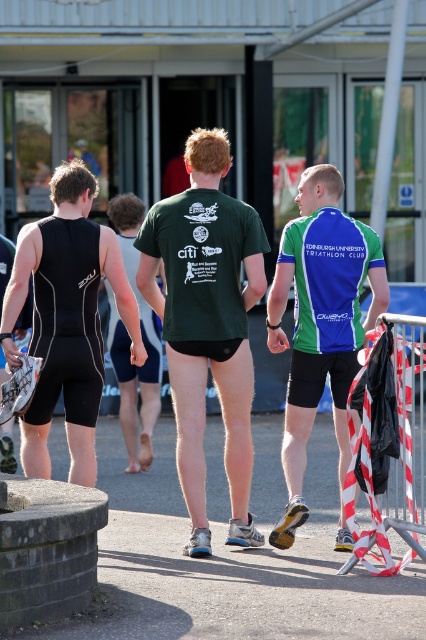
Between green matte t-shirt at center and black matte wetsuit at left, which one has less height?

black matte wetsuit at left

Is green matte t-shirt at center thinner than black matte wetsuit at left?

In fact, green matte t-shirt at center might be wider than black matte wetsuit at left.

What do you see at coordinates (207, 323) in the screenshot?
I see `green matte t-shirt at center` at bounding box center [207, 323].

This screenshot has height=640, width=426. In order to click on green matte t-shirt at center in this screenshot , I will do `click(207, 323)`.

From the picture: Is black matte wetsuit at left closer to the viewer compared to green matte shorts at center?

That is True.

Is black matte wetsuit at left wider than green matte shorts at center?

Incorrect, black matte wetsuit at left's width does not surpass green matte shorts at center's.

Which is in front, point (42, 410) or point (129, 433)?

Point (42, 410) is in front.

Where is `black matte wetsuit at left`? black matte wetsuit at left is located at coordinates (66, 321).

Can you confirm if green/blue jersey at center is bigger than red and white striped tape at right?

Incorrect, green/blue jersey at center is not larger than red and white striped tape at right.

Find the location of a particular element. The width and height of the screenshot is (426, 640). green/blue jersey at center is located at coordinates (321, 323).

Image resolution: width=426 pixels, height=640 pixels. I want to click on green/blue jersey at center, so click(x=321, y=323).